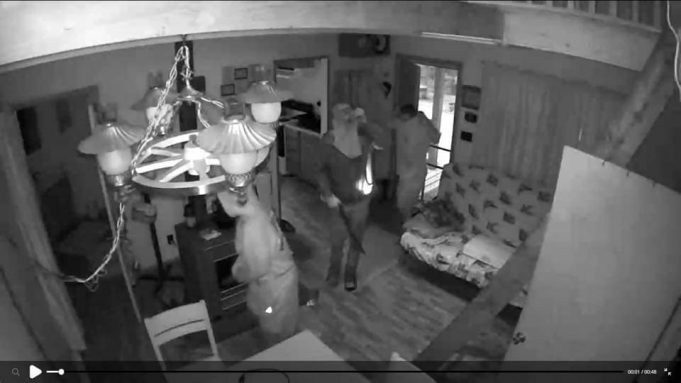
Locate an element on the screen. The image size is (681, 383). light shade is located at coordinates tap(103, 136), tap(146, 93), tap(263, 87), tap(240, 140).